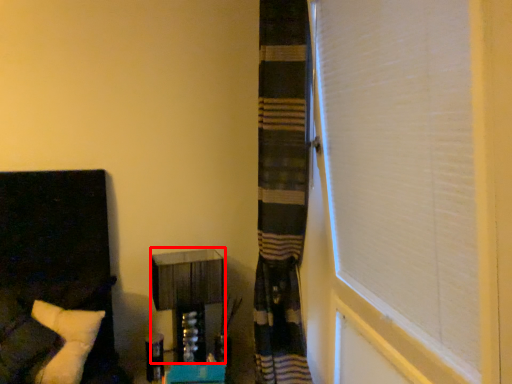
Question: Where is vanity (annotated by the red box) located in relation to furniture in the image?

Choices:
 (A) left
 (B) right

Answer: (B)